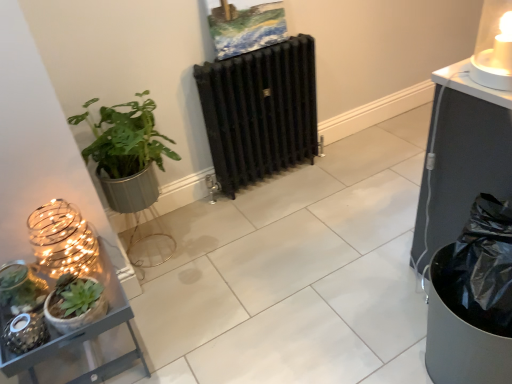
Locate an element on the screen. The width and height of the screenshot is (512, 384). blank space above black cast iron radiator at center (from a real-world perspective) is located at coordinates (256, 45).